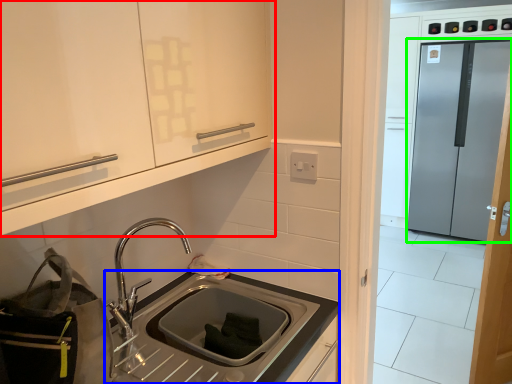
Question: Which object is the farthest from cabinetry (highlighted by a red box)? Choose among these: countertop (highlighted by a blue box) or glass door (highlighted by a green box).

Choices:
 (A) countertop
 (B) glass door

Answer: (B)